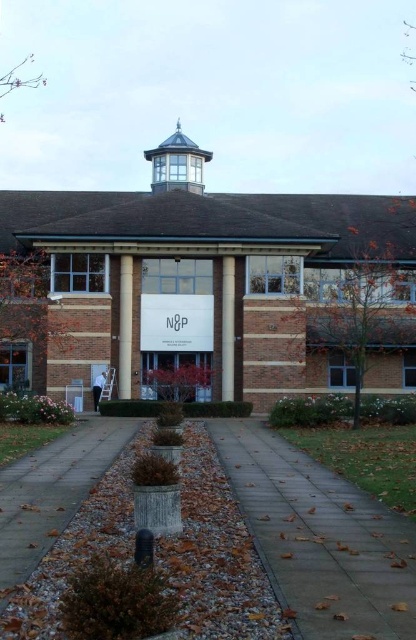
You are standing at the entrance of the modern brick building and want to walk towards the brown wood pillar at left. Which direction should you move relative to the brown gravel at lower left?

To reach the brown wood pillar at left, you should move to the left of the brown gravel at lower left since the brown gravel at lower left is positioned on the right side of the brown wood pillar at left.

Consider the image. You are standing on the paved pathway in front of the brown brick building at center. You want to take a photo of the building with your smartphone. Considering the recommended distance for capturing the entire building in one frame is 18 meters, will you need to move closer or farther away?

The brown brick building at center is 19.30 meters away from viewer. Since the recommended distance is 18 meters, you need to move closer to ensure the entire building fits in the photo.